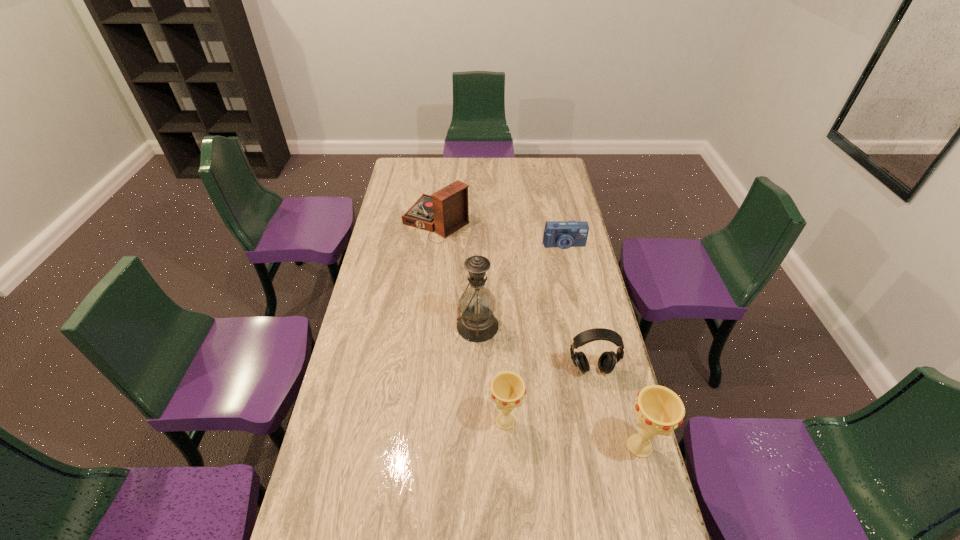
What are the coordinates of `free space for a new chalice on the left` in the screenshot? It's located at (382, 398).